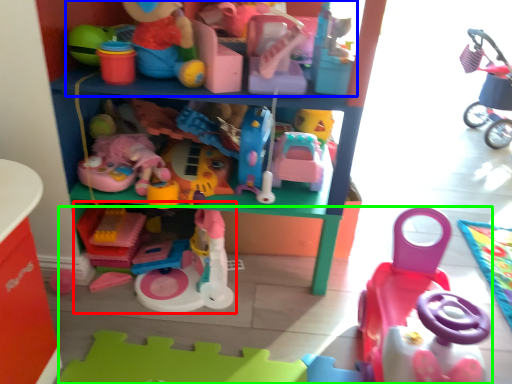
Question: Which object is positioned farthest from toy (highlighted by a red box)? Select from toy (highlighted by a blue box) and toy (highlighted by a green box).

Choices:
 (A) toy
 (B) toy

Answer: (A)